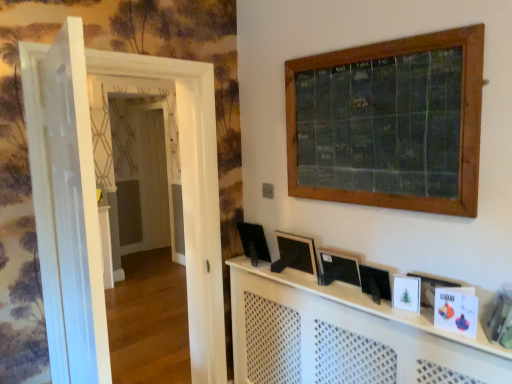
The width and height of the screenshot is (512, 384). In order to click on blank space to the left of black matte picture frame at center, marked as the 3th picture frame in a right-to-left arrangement in this screenshot , I will do `click(272, 271)`.